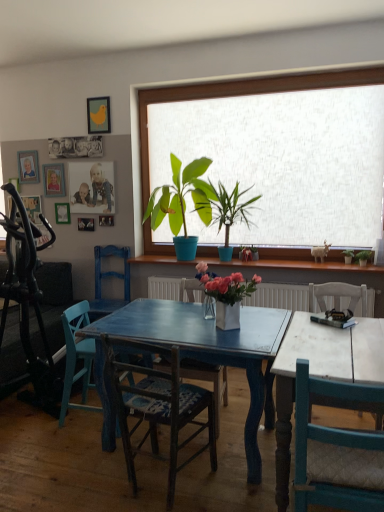
In order to face matte yellow picture frame at upper left, the 5th picture frame when ordered from left to right, should I rotate leftwards or rightwards?

To face it directly, rotate left by 12.265 degrees.

Find the location of a particular element. The image size is (384, 512). wooden chair at center, arranged as the third chair when viewed from the front is located at coordinates (209, 381).

The height and width of the screenshot is (512, 384). What are the coordinates of `blue painted wood chair at left, which appears as the fifth chair when viewed from the front` in the screenshot? It's located at (107, 277).

Locate an element on the screen. This screenshot has width=384, height=512. teal wood chair at right, the fifth chair from the back is located at coordinates point(336,451).

Find the location of a particular element. The height and width of the screenshot is (512, 384). wooden chair with woven seat at center, marked as the 4th chair in a back-to-front arrangement is located at coordinates (158, 407).

Is blue painted wood chair at left, which is counted as the first chair, starting from the back, behind matte yellow picture frame at upper left, the 5th picture frame when ordered from left to right?

No, it is in front of matte yellow picture frame at upper left, the 5th picture frame when ordered from left to right.

From the image's perspective, relative to matte yellow picture frame at upper left, the 1th picture frame viewed from the right, is blue painted wood chair at left, which appears as the fifth chair when viewed from the front, above or below?

blue painted wood chair at left, which appears as the fifth chair when viewed from the front, is below matte yellow picture frame at upper left, the 1th picture frame viewed from the right.

Measure the distance between blue painted wood chair at left, which appears as the fifth chair when viewed from the front, and matte yellow picture frame at upper left, the 5th picture frame when ordered from left to right.

They are 1.43 meters apart.

Which of these two, blue painted wood chair at left, which appears as the fifth chair when viewed from the front, or matte yellow picture frame at upper left, the 1th picture frame viewed from the right, is smaller?

With smaller size is matte yellow picture frame at upper left, the 1th picture frame viewed from the right.

Is matte wooden picture frame at upper left, acting as the fourth picture frame starting from the left, completely or partially outside of teal wood chair at right, the fifth chair from the back?

matte wooden picture frame at upper left, acting as the fourth picture frame starting from the left, lies outside teal wood chair at right, the fifth chair from the back,'s area.

Is point (90, 206) closer or farther from the camera than point (319, 449)?

Clearly, point (90, 206) is more distant from the camera than point (319, 449).

How many degrees apart are the facing directions of matte wooden picture frame at upper left, acting as the fourth picture frame starting from the left, and teal wood chair at right, the fifth chair from the back?

179 degrees.

Is point (250, 293) closer or farther from the camera than point (25, 163)?

Point (250, 293) is closer to the camera than point (25, 163).

From the image's perspective, would you say white ceramic vase at center, marked as the 5th houseplant in a back-to-front arrangement, is shown under wooden photo frame at upper left, the fifth picture frame positioned from the right?

Yes, from the image's perspective, white ceramic vase at center, marked as the 5th houseplant in a back-to-front arrangement, is below wooden photo frame at upper left, the fifth picture frame positioned from the right.

Between white ceramic vase at center, marked as the 5th houseplant in a back-to-front arrangement, and wooden photo frame at upper left, marked as the 1th picture frame in a left-to-right arrangement, which one appears on the right side from the viewer's perspective?

white ceramic vase at center, marked as the 5th houseplant in a back-to-front arrangement, is more to the right.

From a real-world perspective, is white ceramic vase at center, which is the fourth houseplant from right to left, physically located above or below wooden photo frame at upper left, the fifth picture frame positioned from the right?

white ceramic vase at center, which is the fourth houseplant from right to left, is situated lower than wooden photo frame at upper left, the fifth picture frame positioned from the right, in the real world.

How distant is wooden photo frame at upper left, the fifth picture frame positioned from the right, from wooden picture frame at upper left, which appears as the 3th picture frame when viewed from the left?

The distance of wooden photo frame at upper left, the fifth picture frame positioned from the right, from wooden picture frame at upper left, which appears as the 3th picture frame when viewed from the left, is 19.96 inches.

Is wooden picture frame at upper left, which appears as the 3th picture frame when viewed from the left, at the back of wooden photo frame at upper left, the fifth picture frame positioned from the right?

No.

Can you confirm if wooden photo frame at upper left, the fifth picture frame positioned from the right, is shorter than wooden picture frame at upper left, which appears as the 3th picture frame when viewed from the left?

In fact, wooden photo frame at upper left, the fifth picture frame positioned from the right, may be taller than wooden picture frame at upper left, which appears as the 3th picture frame when viewed from the left.

At what (x,y) coordinates should I click in order to perform the action: click on the 3rd picture frame above the wooden picture frame at upper left, which appears as the 3th picture frame when viewed from the left (from the image's perspective). Please return your answer as a coordinate pair (x, y). The image size is (384, 512). Looking at the image, I should click on (28, 166).

Which point is more distant from viewer, (x=90, y=307) or (x=253, y=279)?

Point (x=90, y=307)

Is blue painted wood chair at left, which is counted as the first chair, starting from the back, looking in the opposite direction of white ceramic vase at center, marked as the 5th houseplant in a back-to-front arrangement?

That's not correct — blue painted wood chair at left, which is counted as the first chair, starting from the back, is not looking away from white ceramic vase at center, marked as the 5th houseplant in a back-to-front arrangement.

How many degrees apart are the facing directions of blue painted wood chair at left, which appears as the fifth chair when viewed from the front, and white ceramic vase at center, marked as the 5th houseplant in a back-to-front arrangement?

39.5 degrees separate the facing orientations of blue painted wood chair at left, which appears as the fifth chair when viewed from the front, and white ceramic vase at center, marked as the 5th houseplant in a back-to-front arrangement.

Is white ceramic vase at center, which is the fourth houseplant from right to left, completely or partially inside blue painted wood chair at left, which is counted as the first chair, starting from the back?

No, white ceramic vase at center, which is the fourth houseplant from right to left, is not surrounded by blue painted wood chair at left, which is counted as the first chair, starting from the back.

From a real-world perspective, who is located lower, green glossy plant at center, positioned as the 3th houseplant in right-to-left order, or wooden photo frame at upper left, the fifth picture frame positioned from the right?

In real-world perspective, green glossy plant at center, positioned as the 3th houseplant in right-to-left order, is lower.

Is wooden photo frame at upper left, marked as the 1th picture frame in a left-to-right arrangement, a part of green glossy plant at center, positioned as the 3th houseplant in right-to-left order?

No, wooden photo frame at upper left, marked as the 1th picture frame in a left-to-right arrangement, is not inside green glossy plant at center, positioned as the 3th houseplant in right-to-left order.

From the picture: Is green glossy plant at center, positioned as the 3th houseplant in right-to-left order, further to the viewer compared to wooden photo frame at upper left, the fifth picture frame positioned from the right?

No.

Is green glossy plant at center, positioned as the 3th houseplant in right-to-left order, looking in the opposite direction of wooden photo frame at upper left, marked as the 1th picture frame in a left-to-right arrangement?

No, green glossy plant at center, positioned as the 3th houseplant in right-to-left order,'s orientation is not away from wooden photo frame at upper left, marked as the 1th picture frame in a left-to-right arrangement.

Which houseplant is the 2nd one when counting from the left side of the green glossy plant at center, which is the 2th houseplant in front-to-back order? Please provide its 2D coordinates.

[(181, 197)]

Between point (198, 180) and point (214, 219), which one is positioned behind?

The point (198, 180) is more distant.

In the image, is green matte plant at center, the fifth houseplant viewed from the right, on the left side or the right side of green glossy plant at center, which is the 2th houseplant in front-to-back order?

green matte plant at center, the fifth houseplant viewed from the right, is to the left of green glossy plant at center, which is the 2th houseplant in front-to-back order.

What's the angular difference between green matte plant at center, the fifth houseplant viewed from the right, and green glossy plant at center, which is the 2th houseplant in front-to-back order,'s facing directions?

The angular difference between green matte plant at center, the fifth houseplant viewed from the right, and green glossy plant at center, which is the 2th houseplant in front-to-back order, is 7.49e-05 degrees.

Where is `the 1st chair in front of the matte yellow picture frame at upper left, the 1th picture frame viewed from the right, starting your count from the anchor`? the 1st chair in front of the matte yellow picture frame at upper left, the 1th picture frame viewed from the right, starting your count from the anchor is located at coordinates (107, 277).

Image resolution: width=384 pixels, height=512 pixels. There is a teal wood chair at right, the fifth chair from the back. What are the coordinates of `the 2nd picture frame above it (from the image's perspective)` in the screenshot? It's located at (91, 187).

Considering their positions, is wooden chair with woven seat at center, which ranks as the 2th chair in front-to-back order, positioned further to green matte plant at right, the 1th houseplant from the right, than green matte plant at right, which is the 4th houseplant from left to right?

Based on the image, wooden chair with woven seat at center, which ranks as the 2th chair in front-to-back order, appears to be further to green matte plant at right, the 1th houseplant from the right.

Which object lies nearer to the anchor point wooden picture frame at upper left, which appears as the 3th picture frame when viewed from the left, teal wood chair at right, the fifth chair from the back, or blue painted wood chair at left, which is counted as the first chair, starting from the back?

blue painted wood chair at left, which is counted as the first chair, starting from the back, is positioned closer to the anchor wooden picture frame at upper left, which appears as the 3th picture frame when viewed from the left.

Based on their spatial positions, is dark green fabric couch at left or white ceramic vase at center, which is the 1th houseplant from front to back, further from green glossy plant at center, which is the 2th houseplant in front-to-back order?

dark green fabric couch at left lies further to green glossy plant at center, which is the 2th houseplant in front-to-back order, than the other object.

Based on their spatial positions, is teal wood chair at right, the fifth chair from the back, or matte wooden picture frame at upper left, acting as the fourth picture frame starting from the left, closer to wooden chair with woven seat at center, which ranks as the 2th chair in front-to-back order?

teal wood chair at right, the fifth chair from the back.

Based on their spatial positions, is wooden chair with woven seat at center, which ranks as the 2th chair in front-to-back order, or green matte plant at right, the fourth houseplant positioned from the front, further from blue painted wood chair at left, which is counted as the first chair, starting from the back?

green matte plant at right, the fourth houseplant positioned from the front, is further to blue painted wood chair at left, which is counted as the first chair, starting from the back.

Based on their spatial positions, is wooden photo frame at upper left, the fifth picture frame positioned from the right, or dark green fabric couch at left further from wooden chair at center, arranged as the third chair when viewed from the front?

Among the two, wooden photo frame at upper left, the fifth picture frame positioned from the right, is located further to wooden chair at center, arranged as the third chair when viewed from the front.

Estimate the real-world distances between objects in this image. Which object is closer to wooden chair with woven seat at center, marked as the 4th chair in a back-to-front arrangement, wooden picture frame at upper left, marked as the fourth picture frame in a right-to-left arrangement, or green matte plant at right, arranged as the fifth houseplant when viewed from the front?

green matte plant at right, arranged as the fifth houseplant when viewed from the front, is positioned closer to the anchor wooden chair with woven seat at center, marked as the 4th chair in a back-to-front arrangement.

Considering their positions, is matte wooden picture frame at upper left, which ranks as the 2th picture frame in right-to-left order, positioned closer to green matte plant at center, the fifth houseplant viewed from the right, than green matte plant at right, which is the 4th houseplant from left to right?

matte wooden picture frame at upper left, which ranks as the 2th picture frame in right-to-left order, lies closer to green matte plant at center, the fifth houseplant viewed from the right, than the other object.

Find the location of a particular element. This screenshot has height=512, width=384. chair between matte yellow picture frame at upper left, the 1th picture frame viewed from the right, and dark green fabric couch at left from top to bottom is located at coordinates [107, 277].

Image resolution: width=384 pixels, height=512 pixels. In order to click on houseplant between teal wood chair at right, the first chair from the front, and blue wood chair at center, the 2th chair viewed from the back, along the z-axis in this screenshot , I will do `click(226, 294)`.

Find the location of `couch between blue wood chair at center, the 2th chair viewed from the back, and wooden picture frame at upper left, marked as the fourth picture frame in a right-to-left arrangement, along the z-axis`. couch between blue wood chair at center, the 2th chair viewed from the back, and wooden picture frame at upper left, marked as the fourth picture frame in a right-to-left arrangement, along the z-axis is located at coordinates (54, 298).

Identify the location of chair between wooden chair with woven seat at center, marked as the 4th chair in a back-to-front arrangement, and blue wood chair at center, which ranks as the fourth chair in front-to-back order, from front to back. (209, 381).